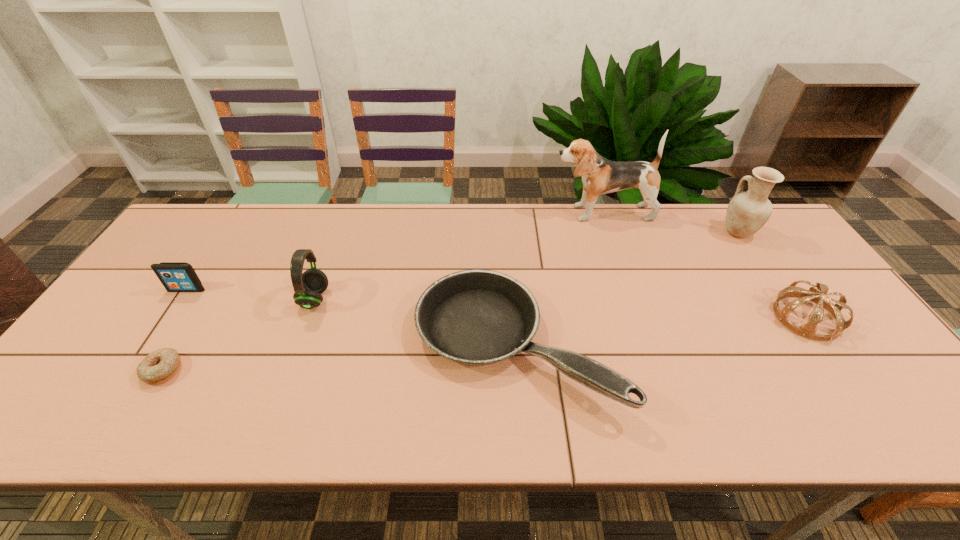
Find the location of a particular element. the tallest object is located at coordinates (600, 176).

Where is `pottery`? pottery is located at coordinates (747, 212).

You are a GUI agent. You are given a task and a screenshot of the screen. Output one action in this format:
    pyautogui.click(x=<x>, y=<y>)
    Task: Click on the headset
    This screenshot has width=960, height=540.
    Given the screenshot: What is the action you would take?
    pyautogui.click(x=308, y=286)

What are the coordinates of `the third tallest object` in the screenshot? It's located at (x=308, y=286).

Locate an element on the screen. tiara is located at coordinates (808, 330).

The height and width of the screenshot is (540, 960). I want to click on iPod, so click(175, 276).

The image size is (960, 540). Identify the location of frying pan. (476, 317).

At what (x,y) coordinates should I click in order to perform the action: click on the shortest object. Please return your answer as a coordinate pair (x, y). This screenshot has width=960, height=540. Looking at the image, I should click on (159, 366).

Locate an element on the screen. This screenshot has width=960, height=540. free spot located at the face of the puppy is located at coordinates (480, 213).

Locate an element on the screen. The image size is (960, 540). vacant region located 0.270m at the face of the puppy is located at coordinates (470, 213).